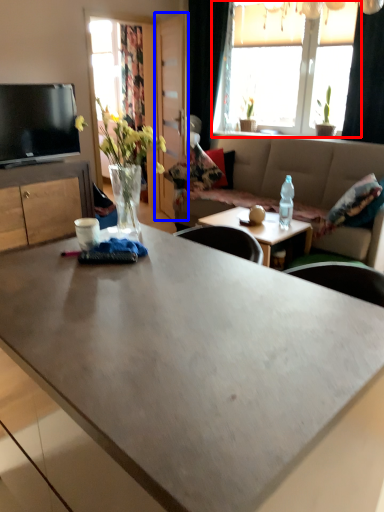
Question: Which object is further to the camera taking this photo, window (highlighted by a red box) or glass door (highlighted by a blue box)?

Choices:
 (A) window
 (B) glass door

Answer: (B)